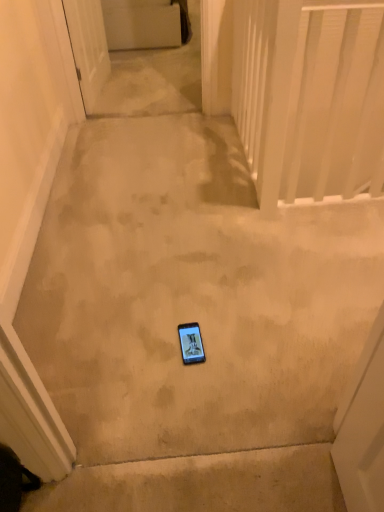
Locate an element on the screen. The width and height of the screenshot is (384, 512). vacant area on the back side of matte black phone at center is located at coordinates (189, 308).